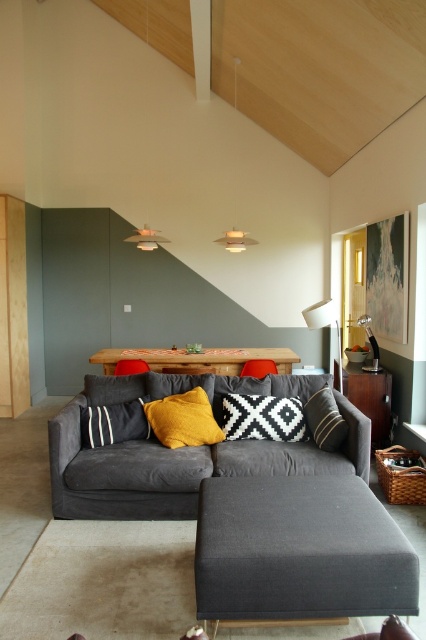
Question: Considering the relative positions of wooden table at center and dark gray fabric pillow at center in the image provided, where is wooden table at center located with respect to dark gray fabric pillow at center?

Choices:
 (A) right
 (B) left

Answer: (B)

Question: Can you confirm if matte fabric ottoman at center is wider than yellow fabric pillow at center?

Choices:
 (A) yes
 (B) no

Answer: (A)

Question: Which object is the closest to the matte fabric ottoman at center?

Choices:
 (A) dark gray fabric couch at center
 (B) dark gray fabric pillow at center
 (C) black woven pillow at center

Answer: (A)

Question: Which of the following is the closest to the observer?

Choices:
 (A) (210, 438)
 (B) (253, 563)

Answer: (B)

Question: Is matte fabric ottoman at center behind black woven pillow at center?

Choices:
 (A) no
 (B) yes

Answer: (A)

Question: Which point is farther to the camera?

Choices:
 (A) click(195, 442)
 (B) click(334, 410)
 (C) click(138, 420)

Answer: (C)